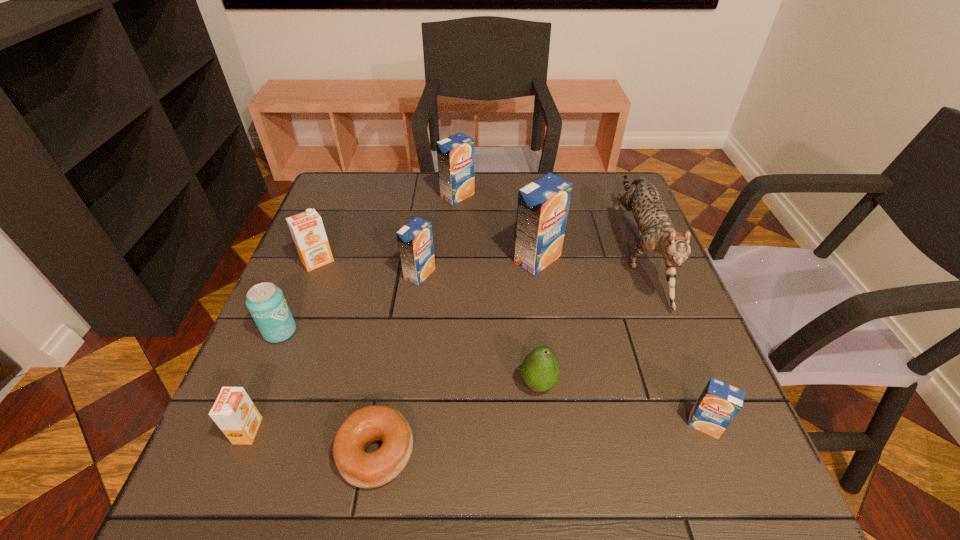
Identify the location of the fifth orange juice from left to right. Image resolution: width=960 pixels, height=540 pixels. (543, 204).

I want to click on the biggest blue orange_juice, so click(x=543, y=204).

Locate an element on the screen. The height and width of the screenshot is (540, 960). cat is located at coordinates (656, 232).

The image size is (960, 540). I want to click on the second biggest blue orange_juice, so click(455, 154).

At what (x,y) coordinates should I click in order to perform the action: click on the farthest blue orange_juice. Please return your answer as a coordinate pair (x, y). The height and width of the screenshot is (540, 960). Looking at the image, I should click on (455, 154).

You are a GUI agent. You are given a task and a screenshot of the screen. Output one action in this format:
    pyautogui.click(x=<x>, y=<y>)
    Task: Click on the second smallest blue orange_juice
    Image resolution: width=960 pixels, height=540 pixels.
    Given the screenshot: What is the action you would take?
    pyautogui.click(x=415, y=241)

This screenshot has width=960, height=540. Find the location of `the bigger orange orange juice`. the bigger orange orange juice is located at coordinates pyautogui.click(x=307, y=229).

You are a GUI agent. You are given a task and a screenshot of the screen. Output one action in this format:
    pyautogui.click(x=<x>, y=<y>)
    Task: Click on the sixth farthest object
    
    Given the screenshot: What is the action you would take?
    pyautogui.click(x=266, y=303)

This screenshot has height=540, width=960. I want to click on avocado, so click(x=541, y=370).

Image resolution: width=960 pixels, height=540 pixels. In order to click on green avocado in this screenshot , I will do `click(541, 370)`.